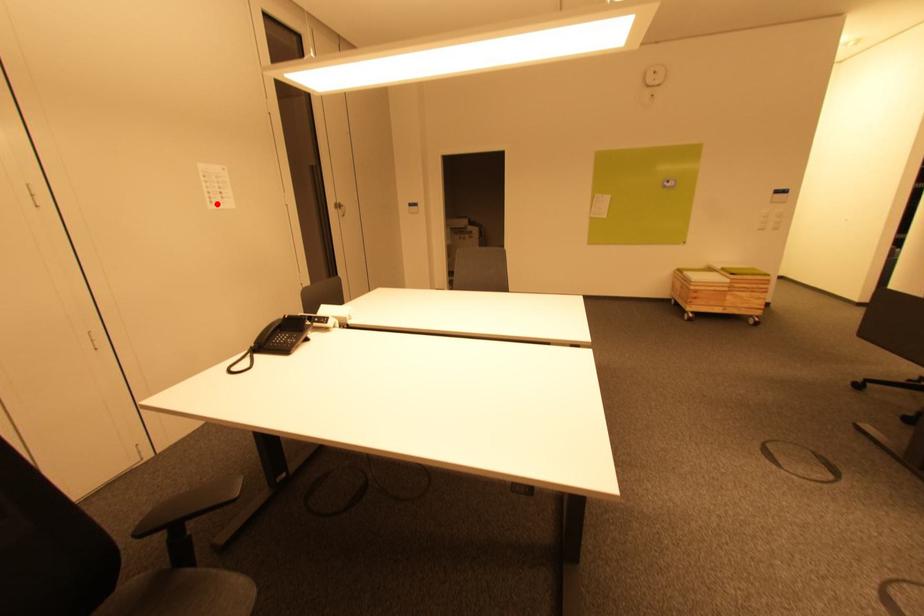
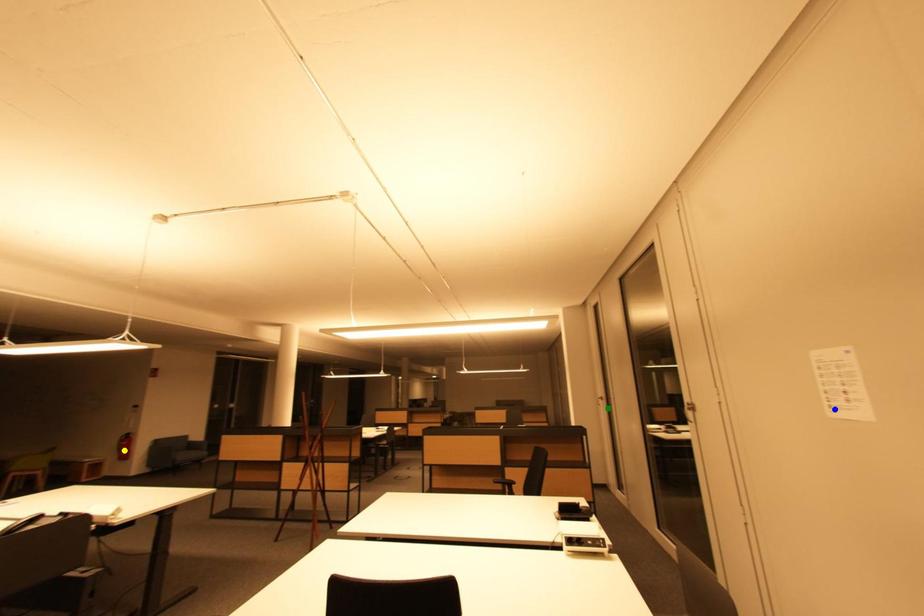
Question: I am providing you with two images of the same scene from different viewpoints. A red point is marked on the first image. You are given multiple points on the second image. Which point in image 2 is actually the same real-world point as the red point in image 1?

Choices:
 (A) yellow point
 (B) blue point
 (C) green point

Answer: (B)